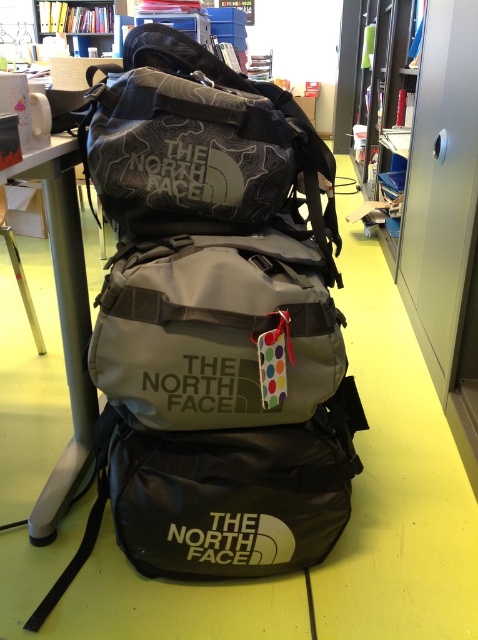
Question: Where is metallic silver table at left located in relation to wooden bookshelf at upper left in the image?

Choices:
 (A) below
 (B) above

Answer: (A)

Question: Which point is farther from the camera taking this photo?

Choices:
 (A) (52, 166)
 (B) (95, 20)

Answer: (B)

Question: Which point is closer to the camera?

Choices:
 (A) (65, 136)
 (B) (86, 17)

Answer: (A)

Question: Which of the following is the farthest from the observer?

Choices:
 (A) wooden bookshelf at upper left
 (B) metallic silver table at left

Answer: (A)

Question: Does metallic silver table at left have a smaller size compared to wooden bookshelf at upper left?

Choices:
 (A) no
 (B) yes

Answer: (B)

Question: Can you confirm if metallic silver table at left is thinner than wooden bookshelf at upper left?

Choices:
 (A) no
 (B) yes

Answer: (B)